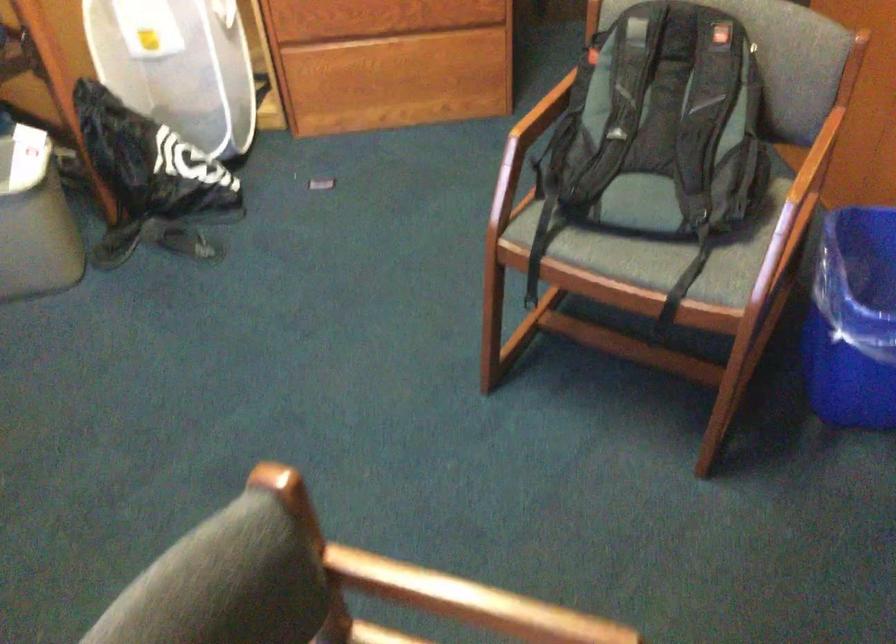
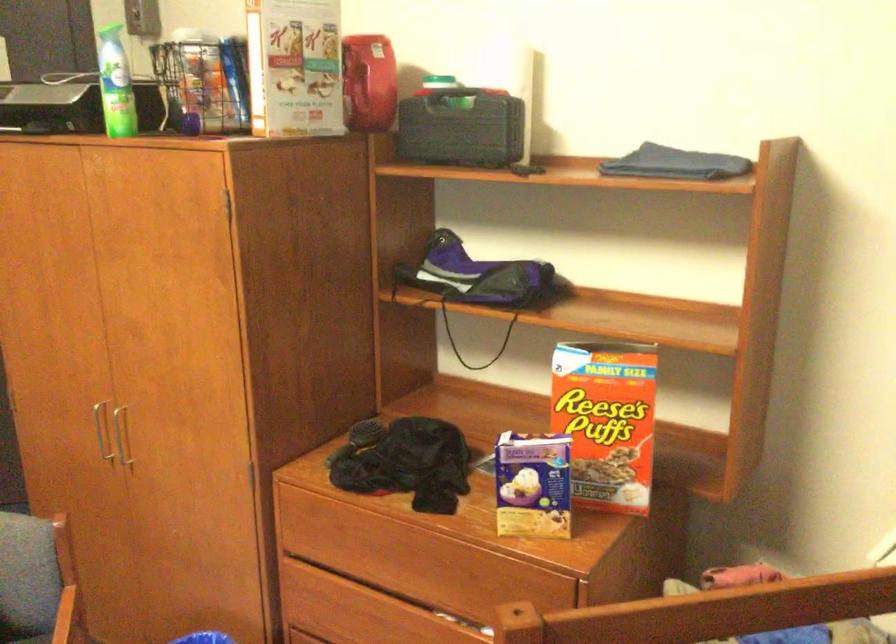
Based on the continuous images, in which direction is the camera rotating?

The rotation direction of the camera is right-up.